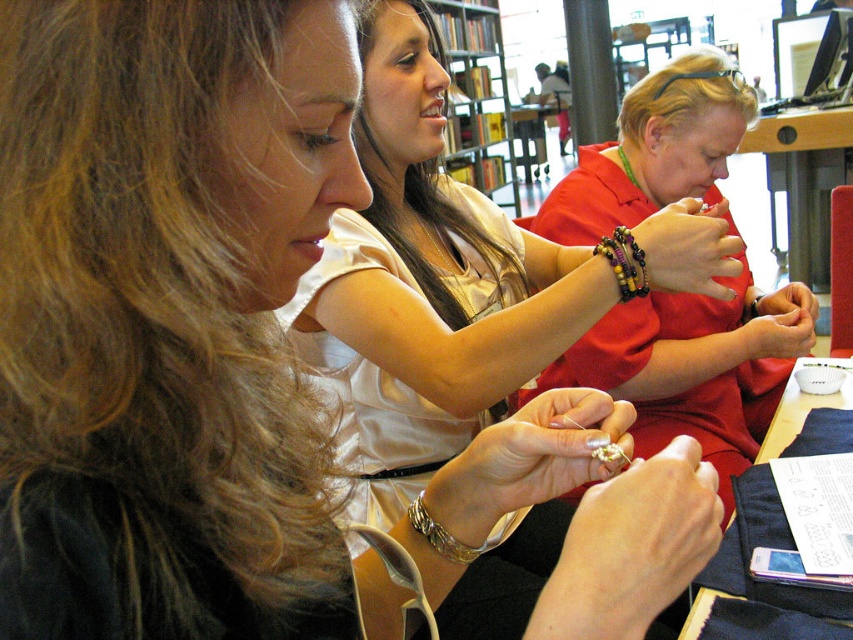
You are a visitor at the library and want to locate the wooden bookshelf at upper center. According to the coordinate system where the bottom left corner is the origin, can you tell me its position?

The wooden bookshelf at upper center is located at coordinates point (477,97).

Based on the photo, you are a craft instructor observing two bracelets in the image. The gold metallic bracelet at lower center and the multicolored beaded bracelet at center. Which bracelet takes up more space?

The multicolored beaded bracelet at center takes up more space than the gold metallic bracelet at lower center.

Looking at this image, you are a visitor in the library and want to place a book on the wooden bookshelf at upper center. However, there is a wooden beads bracelet at center in the way. Can you place the book on the shelf without moving the bracelet?

The wooden bookshelf at upper center is positioned over the wooden beads bracelet at center, meaning the shelf is above the bracelet. Therefore, you can place the book on the wooden bookshelf at upper center without disturbing the bracelet since they are at different heights.